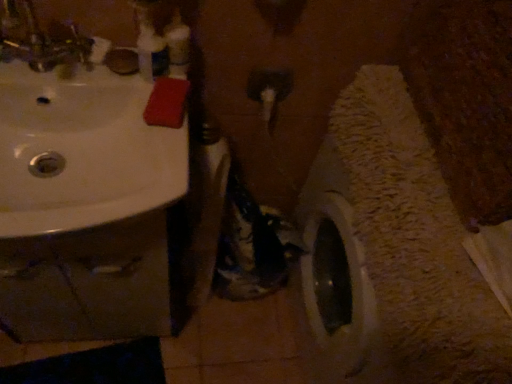
Question: Is translucent plastic bottle at upper center positioned far away from brushed metal faucet at upper left?

Choices:
 (A) yes
 (B) no

Answer: (B)

Question: From a real-world perspective, is translucent plastic bottle at upper center on top of brushed metal faucet at upper left?

Choices:
 (A) no
 (B) yes

Answer: (A)

Question: Is translucent plastic bottle at upper center thinner than brushed metal faucet at upper left?

Choices:
 (A) no
 (B) yes

Answer: (B)

Question: Can you confirm if translucent plastic bottle at upper center is shorter than brushed metal faucet at upper left?

Choices:
 (A) no
 (B) yes

Answer: (B)

Question: Is translucent plastic bottle at upper center touching brushed metal faucet at upper left?

Choices:
 (A) no
 (B) yes

Answer: (A)

Question: From the image's perspective, is white glossy sink at upper left above or below translucent plastic bottle at upper center?

Choices:
 (A) below
 (B) above

Answer: (A)

Question: From a real-world perspective, is white glossy sink at upper left above or below translucent plastic bottle at upper center?

Choices:
 (A) below
 (B) above

Answer: (A)

Question: Is point (143, 56) positioned closer to the camera than point (174, 69)?

Choices:
 (A) farther
 (B) closer

Answer: (B)

Question: Based on their positions, is white glossy sink at upper left located to the left or right of translucent plastic bottle at upper center?

Choices:
 (A) right
 (B) left

Answer: (B)

Question: In terms of height, does white glossy sink at upper left look taller or shorter compared to brushed metal faucet at upper left?

Choices:
 (A) short
 (B) tall

Answer: (A)

Question: Is white glossy sink at upper left wider or thinner than brushed metal faucet at upper left?

Choices:
 (A) wide
 (B) thin

Answer: (A)

Question: Does point (x=71, y=72) appear closer or farther from the camera than point (x=10, y=44)?

Choices:
 (A) farther
 (B) closer

Answer: (A)

Question: Considering the positions of white glossy sink at upper left and brushed metal faucet at upper left in the image, is white glossy sink at upper left bigger or smaller than brushed metal faucet at upper left?

Choices:
 (A) big
 (B) small

Answer: (A)

Question: Is brushed metal faucet at upper left taller or shorter than white glossy sink at upper left?

Choices:
 (A) tall
 (B) short

Answer: (A)

Question: Looking at their shapes, would you say brushed metal faucet at upper left is wider or thinner than white glossy sink at upper left?

Choices:
 (A) wide
 (B) thin

Answer: (B)